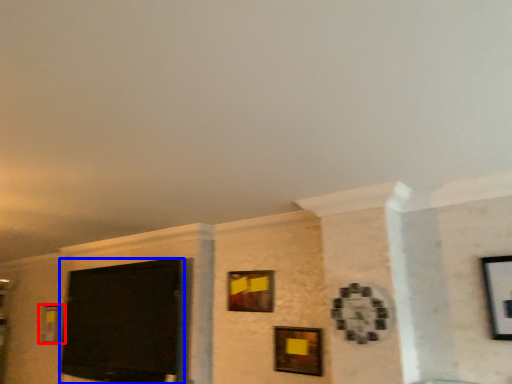
Question: Which object is closer to the camera taking this photo, picture frame (highlighted by a red box) or projection screen (highlighted by a blue box)?

Choices:
 (A) picture frame
 (B) projection screen

Answer: (B)